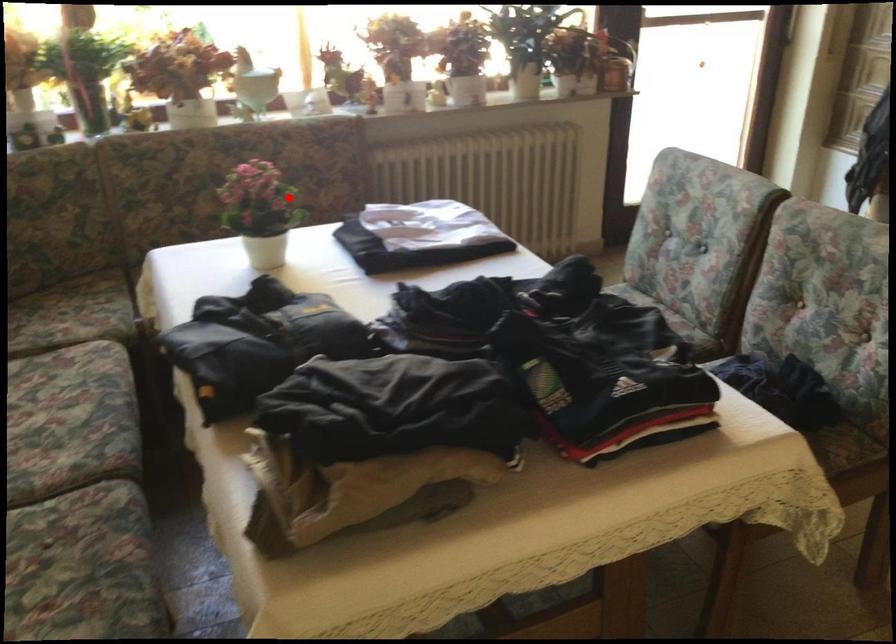
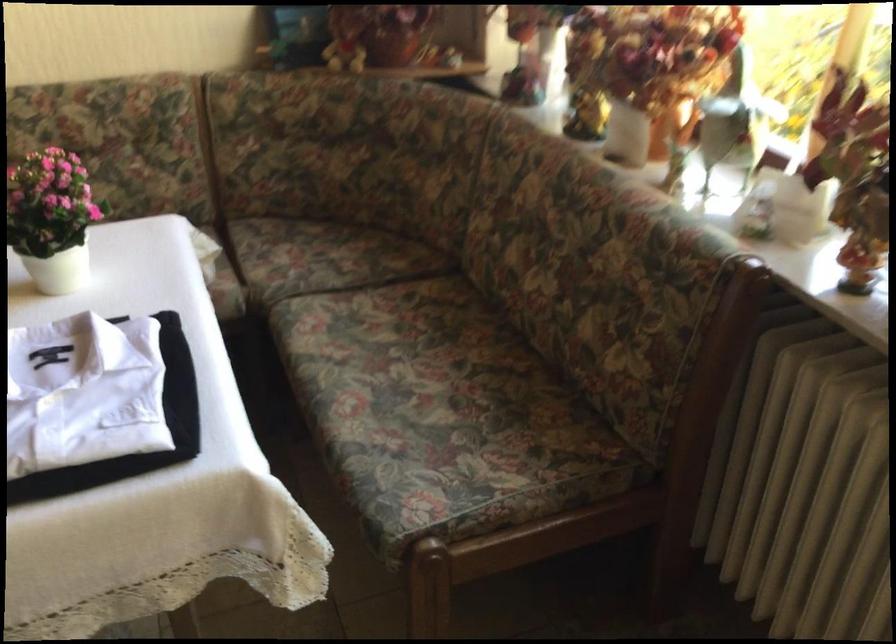
Locate, in the second image, the point that corresponds to the highlighted location in the first image.

(52, 218)